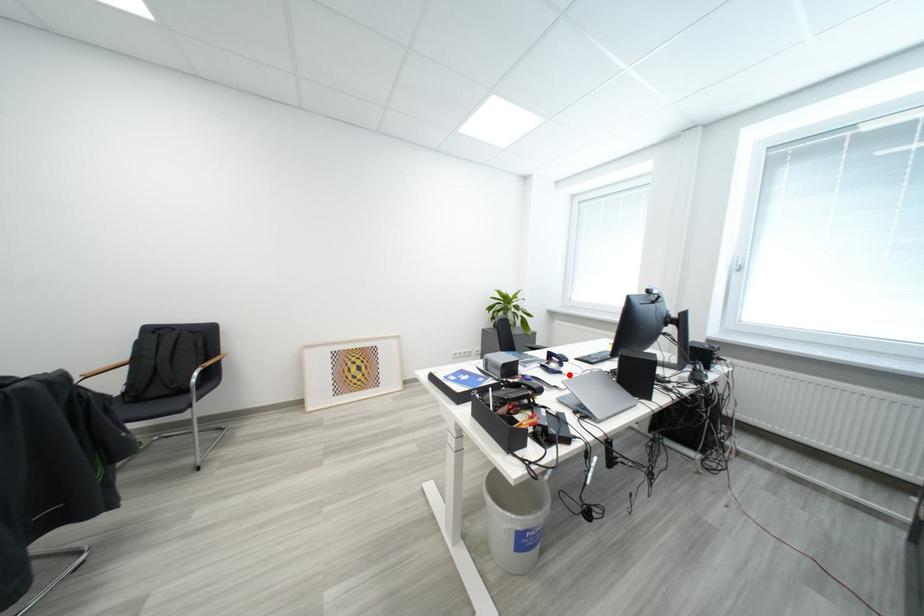
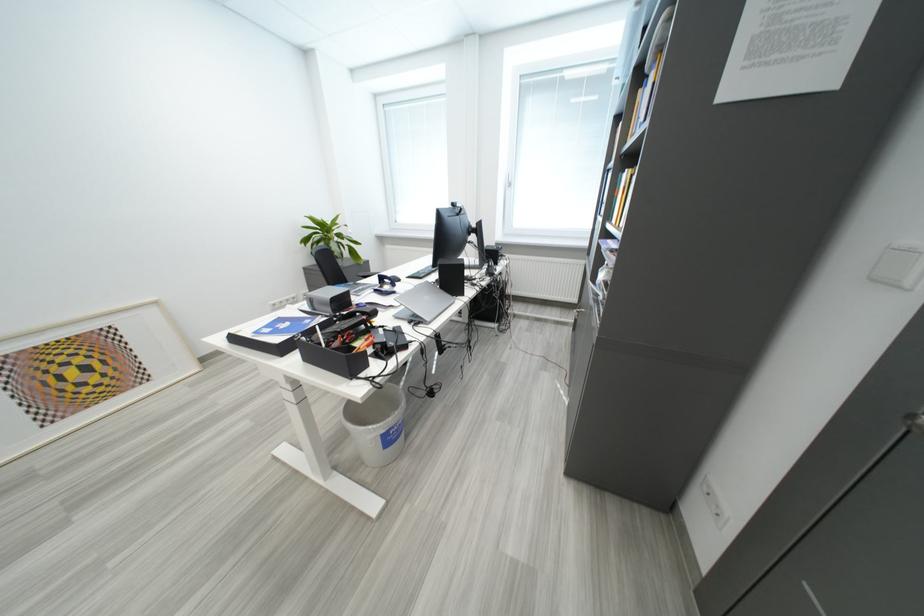
Where in the second image is the point corresponding to the highlighted location from the first image?

(403, 294)